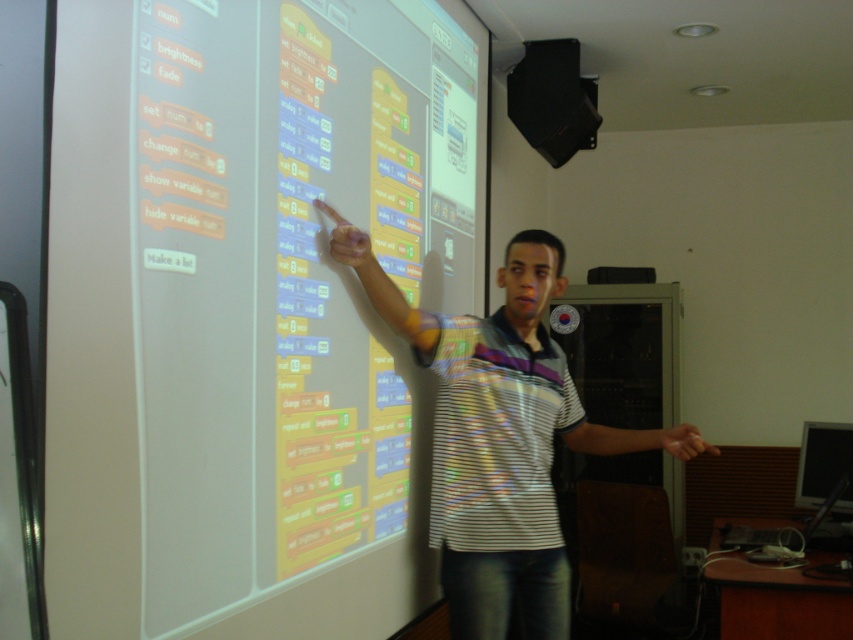
You are a student sitting in the classroom and want to see both points mentioned in the presentation. Which point is closer to you, point at coordinate (x=260, y=19) or point at coordinate (x=468, y=477)?

Point at coordinate (x=260, y=19) is in front of point at coordinate (x=468, y=477), so it is closer to you.

You are a student sitting in the classroom and want to look at both the white matte projection screen at upper left and the white striped shirt at center. Which object should you turn your head to the right to see?

To see the white striped shirt at center, you should turn your head to the right from the white matte projection screen at upper left because the white striped shirt at center is to the right of the white matte projection screen at upper left.

You are a student sitting in the classroom and want to locate the white matte projection screen at upper left. The teacher is pointing at a specific coordinate on the screen. If the teacher is pointing at point (248,308), where exactly on the white matte projection screen at upper left is the teacher pointing?

The point (248,308) corresponds to the white matte projection screen at upper left, so the teacher is pointing at that exact location on the screen.